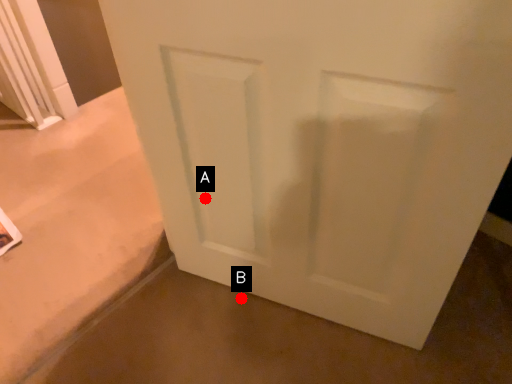
Question: Two points are circled on the image, labeled by A and B beside each circle. Which point appears closest to the camera in this image?

Choices:
 (A) A is closer
 (B) B is closer

Answer: (A)